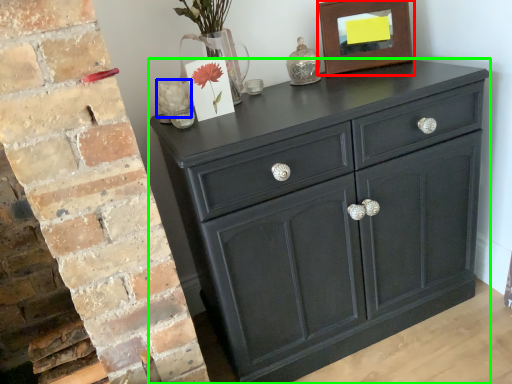
Question: Estimate the real-world distances between objects in this image. Which object is farther from picture frame (highlighted by a red box), flower (highlighted by a blue box) or chest of drawers (highlighted by a green box)?

Choices:
 (A) flower
 (B) chest of drawers

Answer: (A)